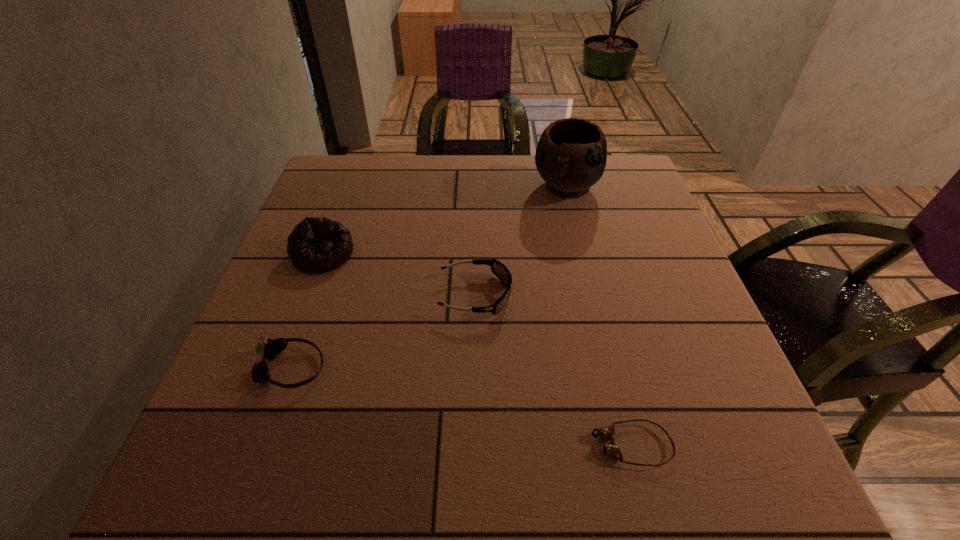
Image resolution: width=960 pixels, height=540 pixels. I want to click on free spot between the second goggles from left to right and the second farthest goggles, so click(x=383, y=332).

Locate an element on the screen. This screenshot has height=540, width=960. unoccupied area between the shortest goggles and the second tallest object is located at coordinates (477, 349).

Where is `vacant space that's between the farthest goggles and the beanbag`? The image size is (960, 540). vacant space that's between the farthest goggles and the beanbag is located at coordinates point(399,274).

Where is `vacant area that lies between the second farthest goggles and the farthest goggles`? Image resolution: width=960 pixels, height=540 pixels. vacant area that lies between the second farthest goggles and the farthest goggles is located at coordinates (383, 332).

Where is `free space between the rightmost goggles and the second tallest object`? free space between the rightmost goggles and the second tallest object is located at coordinates (477, 349).

Where is `free space between the fourth farthest object and the shortest goggles`? free space between the fourth farthest object and the shortest goggles is located at coordinates (461, 407).

The height and width of the screenshot is (540, 960). Identify the location of free point between the second nearest goggles and the tallest object. (428, 277).

At what (x,y) coordinates should I click in order to perform the action: click on empty location between the third object from right to left and the leftmost goggles. Please return your answer as a coordinate pair (x, y). Image resolution: width=960 pixels, height=540 pixels. Looking at the image, I should click on (383, 332).

Locate an element on the screen. free area in between the tallest object and the second goggles from left to right is located at coordinates (520, 240).

Identify the location of object that is the third closest to the second tallest object. Image resolution: width=960 pixels, height=540 pixels. (571, 155).